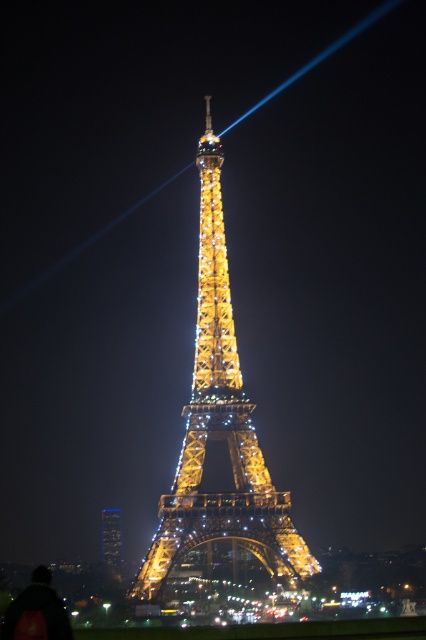
Question: Which point is farther from the camera taking this photo?

Choices:
 (A) (37, 636)
 (B) (207, 208)
 (C) (109, 513)

Answer: (C)

Question: Is black fabric at lower left smaller than golden metallic eiffel tower at center?

Choices:
 (A) no
 (B) yes

Answer: (A)

Question: Is illuminated gold metal eiffel tower at center closer to the viewer compared to golden metallic eiffel tower at center?

Choices:
 (A) no
 (B) yes

Answer: (B)

Question: Which object is farther from the camera taking this photo?

Choices:
 (A) illuminated gold metal eiffel tower at center
 (B) black fabric at lower left
 (C) golden metallic eiffel tower at center

Answer: (C)

Question: Does illuminated gold metal eiffel tower at center appear under golden metallic eiffel tower at center?

Choices:
 (A) no
 (B) yes

Answer: (A)

Question: Which point appears farthest from the camera in this image?

Choices:
 (A) (144, 586)
 (B) (101, 544)
 (C) (66, 637)

Answer: (B)